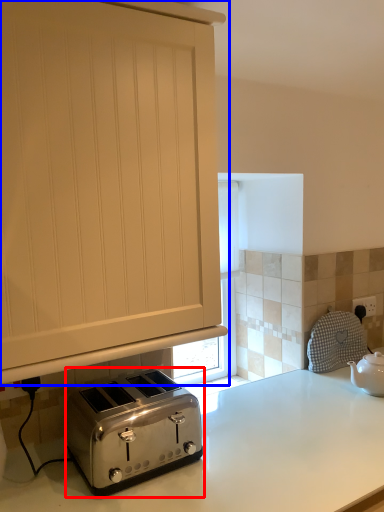
Question: Which point is closer to the camera, toaster (highlighted by a red box) or cabinetry (highlighted by a blue box)?

Choices:
 (A) toaster
 (B) cabinetry

Answer: (B)